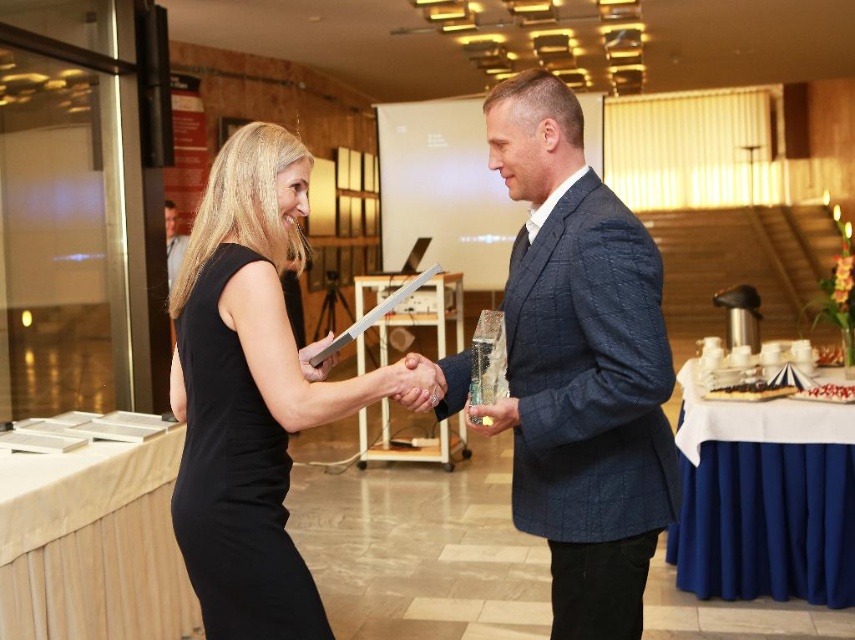
Between black matte dress at center and blue fabric table at lower right, which one has more height?

black matte dress at center is taller.

Can you confirm if black matte dress at center is positioned to the left of blue fabric table at lower right?

Indeed, black matte dress at center is positioned on the left side of blue fabric table at lower right.

Describe the element at coordinates (251, 392) in the screenshot. I see `black matte dress at center` at that location.

Image resolution: width=855 pixels, height=640 pixels. I want to click on black matte dress at center, so click(251, 392).

Is point (234, 634) closer to viewer compared to point (440, 314)?

Yes.

Is black satin dress at center smaller than wooden table at center?

Indeed, black satin dress at center has a smaller size compared to wooden table at center.

Does point (215, 312) come farther from viewer compared to point (455, 445)?

No, it is in front of (455, 445).

At what (x,y) coordinates should I click in order to perform the action: click on black satin dress at center. Please return your answer as a coordinate pair (x, y). The height and width of the screenshot is (640, 855). Looking at the image, I should click on [x=234, y=481].

Which of these two, blue fabric table at lower right or wooden table at center, stands shorter?

With less height is wooden table at center.

Which is in front, point (783, 516) or point (386, 323)?

Point (783, 516) is more forward.

You are a GUI agent. You are given a task and a screenshot of the screen. Output one action in this format:
    pyautogui.click(x=<x>, y=<y>)
    Task: Click on the blue fabric table at lower right
    
    Given the screenshot: What is the action you would take?
    pyautogui.click(x=764, y=499)